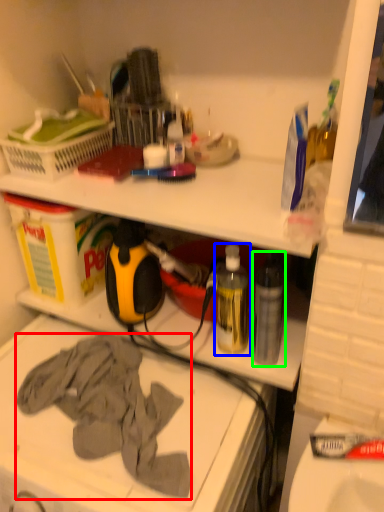
Question: Based on their relative distances, which object is farther from clothing (highlighted by a red box)? Choose from bottle (highlighted by a blue box) and bottle (highlighted by a green box).

Choices:
 (A) bottle
 (B) bottle

Answer: (B)